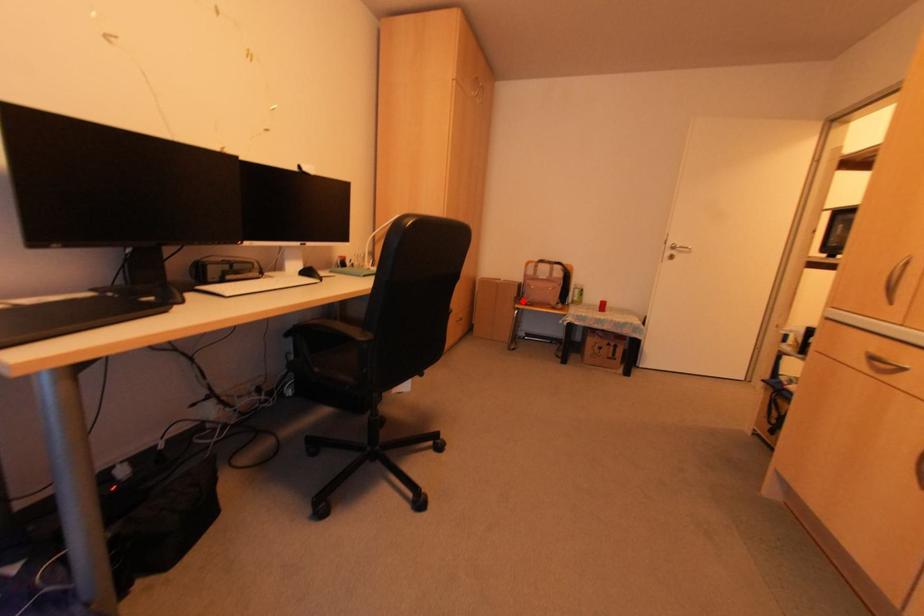
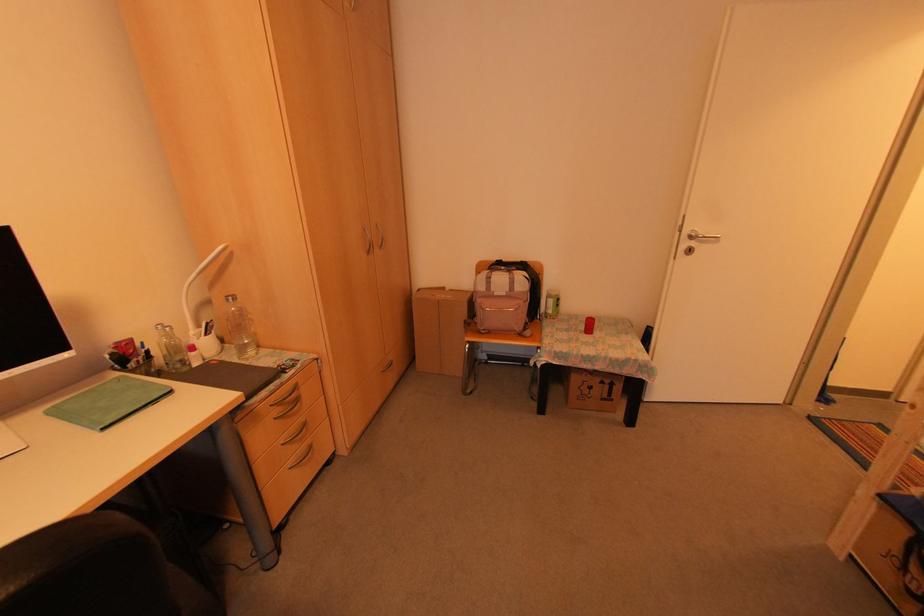
Locate, in the second image, the point that corresponds to the highlighted location in the first image.

(477, 326)